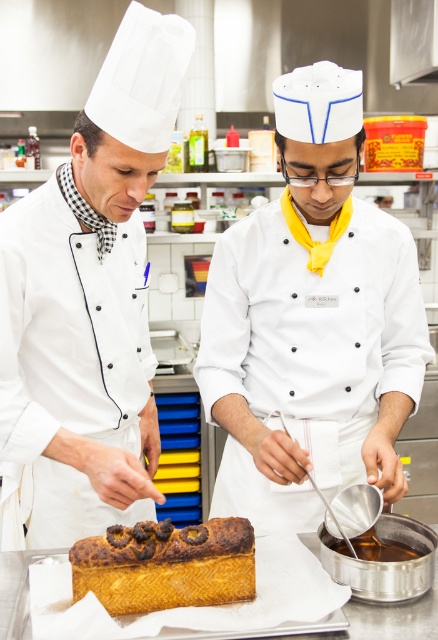
Question: Does white matte chef hat at left appear on the left side of golden brown sponge cake at center?

Choices:
 (A) no
 (B) yes

Answer: (B)

Question: Which object appears farthest from the camera in this image?

Choices:
 (A) white matte chef hat at left
 (B) white glossy chef hat at center
 (C) golden brown sponge cake at center

Answer: (B)

Question: Where is white glossy chef hat at center located in relation to white matte chef hat at left in the image?

Choices:
 (A) left
 (B) right

Answer: (B)

Question: Can you confirm if white matte chef hat at left is thinner than golden brown sponge cake at center?

Choices:
 (A) no
 (B) yes

Answer: (A)

Question: Which of the following is the farthest from the observer?

Choices:
 (A) golden brown sponge cake at center
 (B) white glossy chef hat at center
 (C) white matte chef hat at left

Answer: (B)

Question: Which point is closer to the camera taking this photo?

Choices:
 (A) (353, 93)
 (B) (136, 378)
 (C) (140, 560)

Answer: (C)